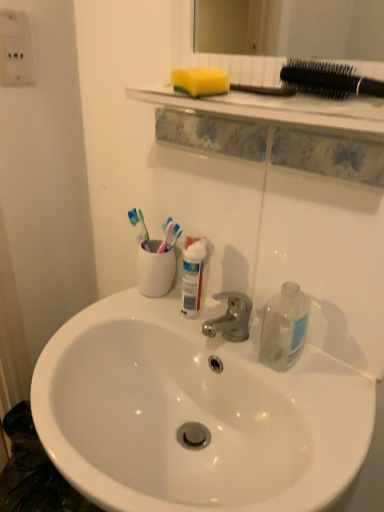
Where is `free space in front of transparent glass bottle at right`? The image size is (384, 512). free space in front of transparent glass bottle at right is located at coordinates (311, 406).